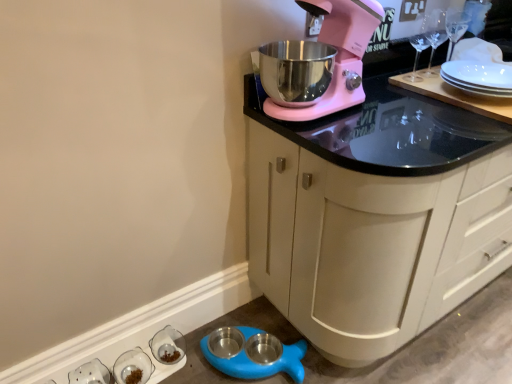
You are a GUI agent. You are given a task and a screenshot of the screen. Output one action in this format:
    pyautogui.click(x=<x>, y=<y>)
    Task: Click on the unoccupied space behind blue rubber pet bowls at lower left
    
    Given the screenshot: What is the action you would take?
    pyautogui.click(x=252, y=315)